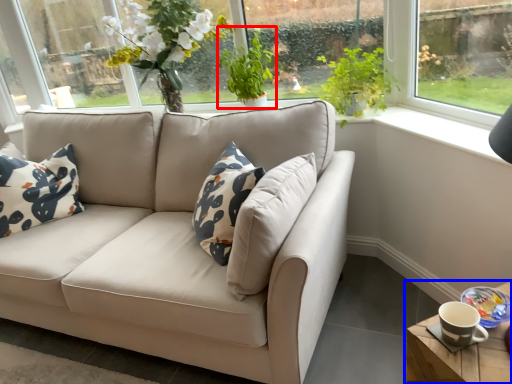
Question: Which of the following is the farthest to the observer, plant (highlighted by a red box) or table (highlighted by a blue box)?

Choices:
 (A) plant
 (B) table

Answer: (A)